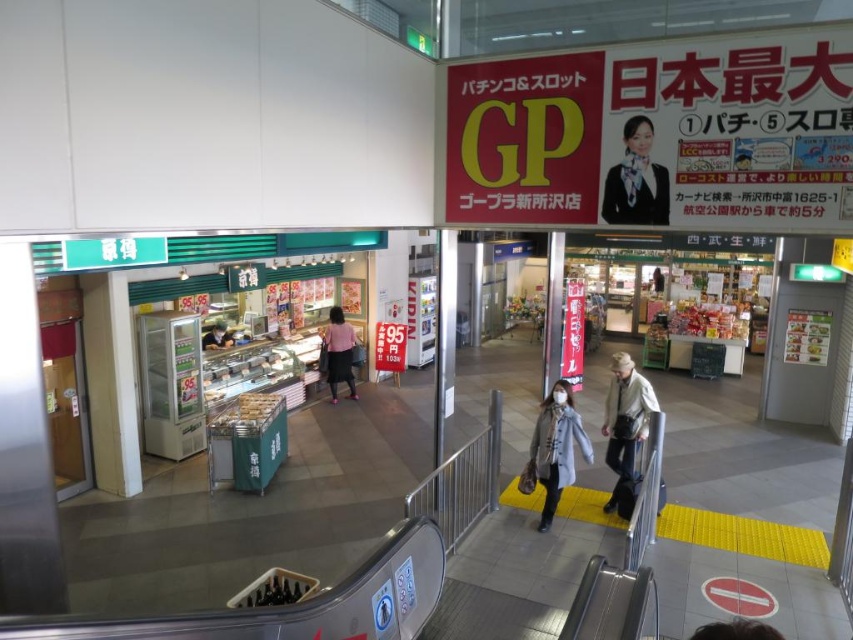
Question: Can you confirm if matte black uniform at upper right is smaller than pink fabric dress at center?

Choices:
 (A) no
 (B) yes

Answer: (B)

Question: Which point is farther to the camera?

Choices:
 (A) matte black uniform at upper right
 (B) matte pink shirt at center
 (C) matte black bag at center

Answer: (B)

Question: Where is matte black uniform at upper right located in relation to matte pink shirt at center in the image?

Choices:
 (A) left
 (B) right

Answer: (B)

Question: Which of the following is the farthest from the observer?

Choices:
 (A) matte black uniform at upper right
 (B) pink fabric dress at center

Answer: (B)

Question: Which object appears farthest from the camera in this image?

Choices:
 (A) light brown leather jacket at center
 (B) light gray wool coat at center
 (C) matte black bag at center

Answer: (A)

Question: Does matte black uniform at upper right have a larger size compared to light gray wool coat at center?

Choices:
 (A) yes
 (B) no

Answer: (B)